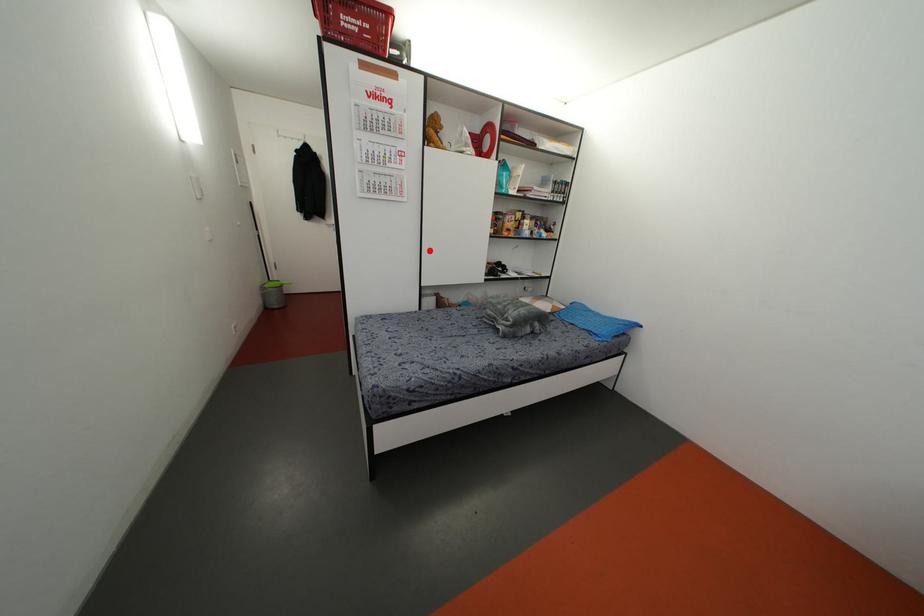
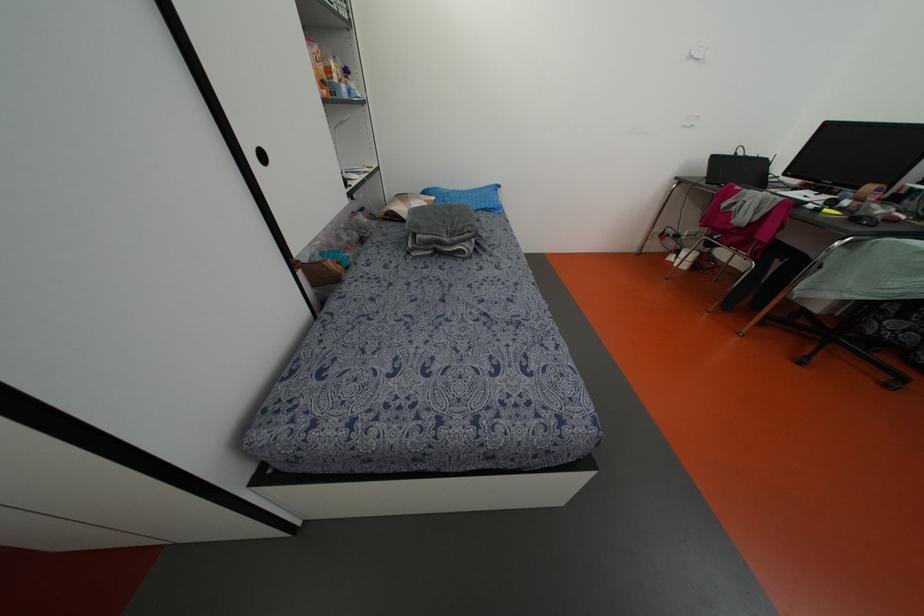
Locate, in the second image, the point that corresponds to the highlighted location in the first image.

(262, 156)